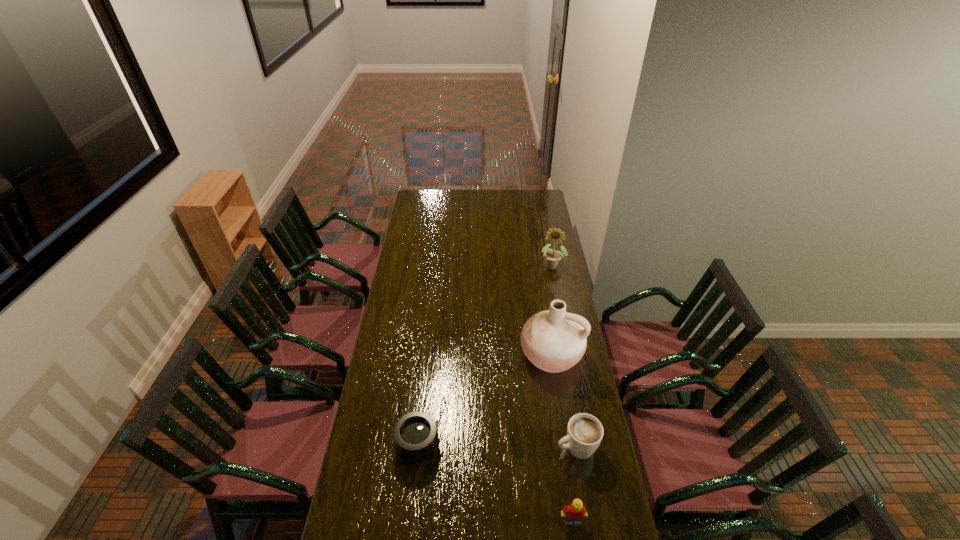
The width and height of the screenshot is (960, 540). What are the coordinates of `the leftmost object` in the screenshot? It's located at coord(415,434).

What are the coordinates of `the shortest object` in the screenshot? It's located at (415, 434).

Locate an element on the screen. The image size is (960, 540). Lego is located at coordinates (573, 514).

Identify the location of cappuccino. (584, 431).

You are a GUI agent. You are given a task and a screenshot of the screen. Output one action in this format:
    pyautogui.click(x=<x>, y=<y>)
    Task: Click on the farthest object
    This screenshot has width=960, height=540.
    Given the screenshot: What is the action you would take?
    pyautogui.click(x=552, y=257)

Where is `the fourth nearest object`? The image size is (960, 540). the fourth nearest object is located at coordinates point(554,340).

Image resolution: width=960 pixels, height=540 pixels. What are the coordinates of `vacant space positioned 0.050m on the side of the shortest object with brand markings and control switches` in the screenshot? It's located at (454, 446).

This screenshot has width=960, height=540. I want to click on blank area located 0.180m with the handle on the side of the cappuccino, so click(513, 470).

Where is `vacant space located 0.060m with the handle on the side of the cappuccino`? vacant space located 0.060m with the handle on the side of the cappuccino is located at coordinates (542, 458).

At what (x,y) coordinates should I click in order to perform the action: click on free location located with the handle on the side of the cappuccino. Please return your answer as a coordinate pair (x, y). This screenshot has width=960, height=540. Looking at the image, I should click on (457, 491).